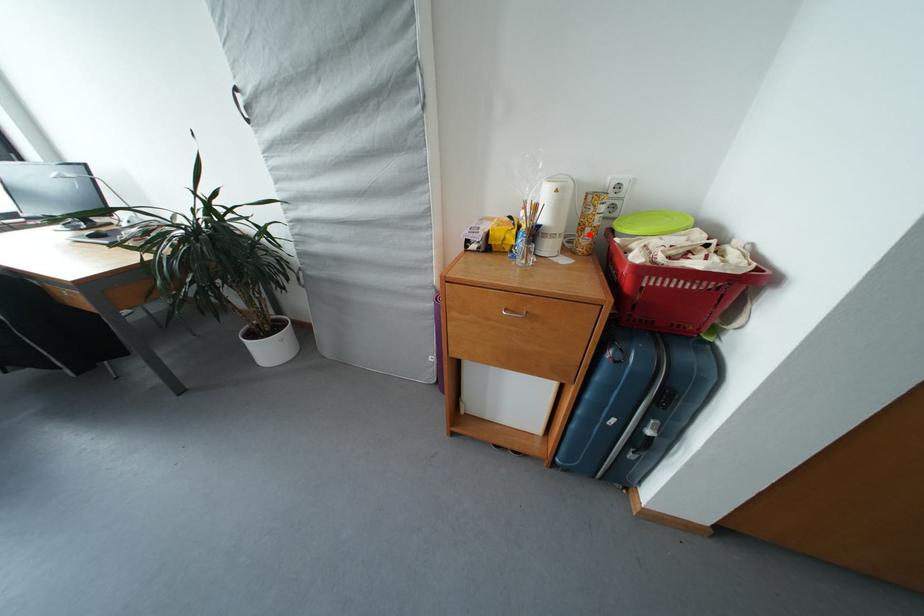
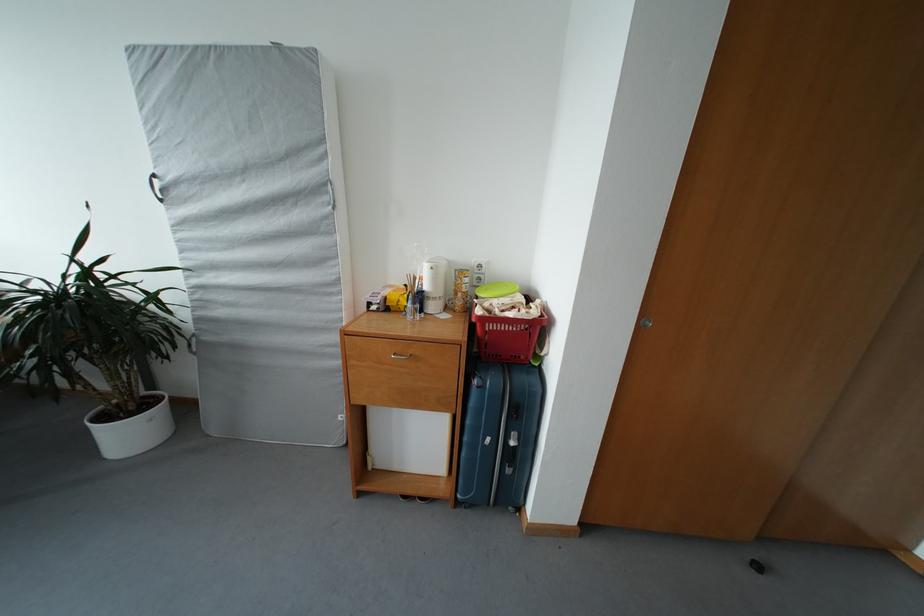
Find the pixel in the second image that matches the highlighted location in the first image.

(463, 300)